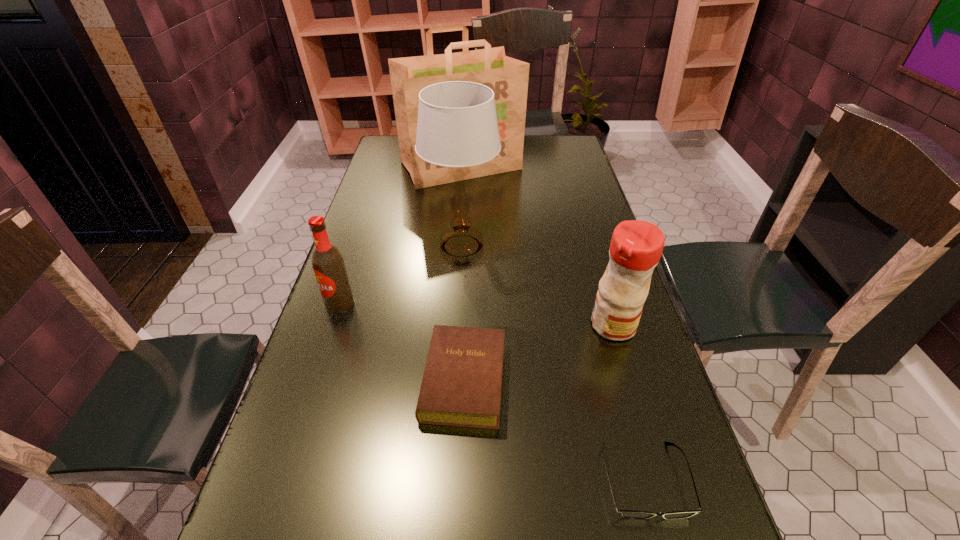
What are the coordinates of `free region at the far right corner` in the screenshot? It's located at 553,156.

Locate an element on the screen. This screenshot has width=960, height=540. vacant area between the farthest object and the shortest object is located at coordinates (553, 323).

Where is `vacant space that's between the Bible and the second farthest object`? The height and width of the screenshot is (540, 960). vacant space that's between the Bible and the second farthest object is located at coordinates (463, 313).

Where is `free spot between the farthest object and the spectacles`? The width and height of the screenshot is (960, 540). free spot between the farthest object and the spectacles is located at coordinates (553, 323).

The width and height of the screenshot is (960, 540). Find the location of `empty space that is in between the grocery bag and the beer bottle`. empty space that is in between the grocery bag and the beer bottle is located at coordinates (400, 235).

Where is `unoccupied area between the fifth nearest object and the second shortest object`? unoccupied area between the fifth nearest object and the second shortest object is located at coordinates (463, 313).

This screenshot has width=960, height=540. I want to click on vacant space that is in between the beer bottle and the condiment, so click(x=476, y=314).

You are a GUI agent. You are given a task and a screenshot of the screen. Output one action in this format:
    pyautogui.click(x=<x>, y=<y>)
    Task: Click on the free space between the condiment and the grocery bag
    
    Given the screenshot: What is the action you would take?
    pyautogui.click(x=538, y=246)

Where is `empty space between the condiment and the fifth nearest object`? empty space between the condiment and the fifth nearest object is located at coordinates (538, 286).

At what (x,y) coordinates should I click in order to perform the action: click on vacant area that lies between the Bible and the spectacles. Please return your answer as a coordinate pair (x, y). Looking at the image, I should click on (554, 430).